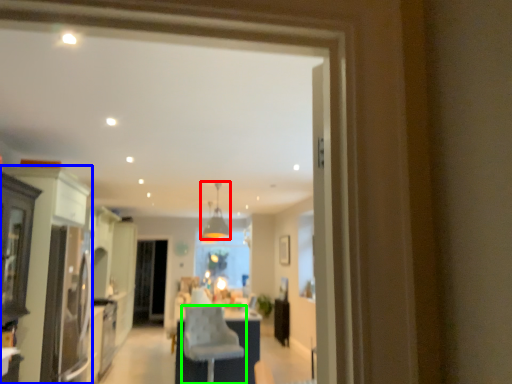
Question: Estimate the real-world distances between objects in this image. Which object is farther from light fixture (highlighted by a red box), cabinetry (highlighted by a blue box) or chair (highlighted by a green box)?

Choices:
 (A) cabinetry
 (B) chair

Answer: (A)